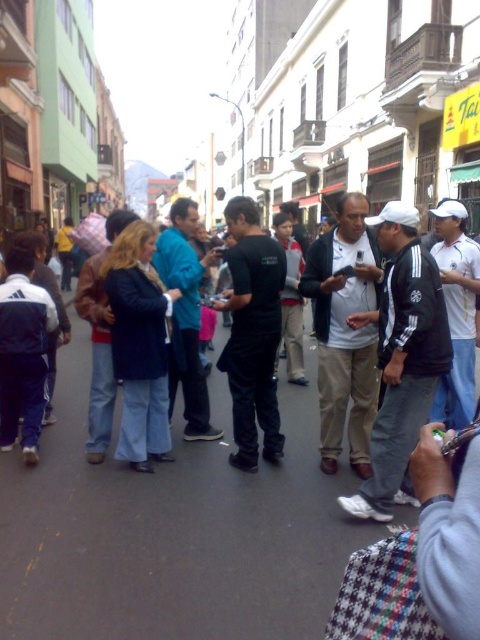
You are a fashion designer analyzing the outfit of a person in the scene. Based on the image, does the black matte shirt at center appear to be worn over or under the blue denim jeans at center?

The black matte shirt at center is positioned under the blue denim jeans at center, so it appears to be worn under the jeans.

You are a photographer trying to capture a candid shot of the crowd in the bustling street scene. You notice the black matte shirt at center and the blue denim jeans at center. Which clothing item appears narrower in your photo?

The black matte shirt at center appears narrower in the photo since it has a lesser width compared to the blue denim jeans at center.